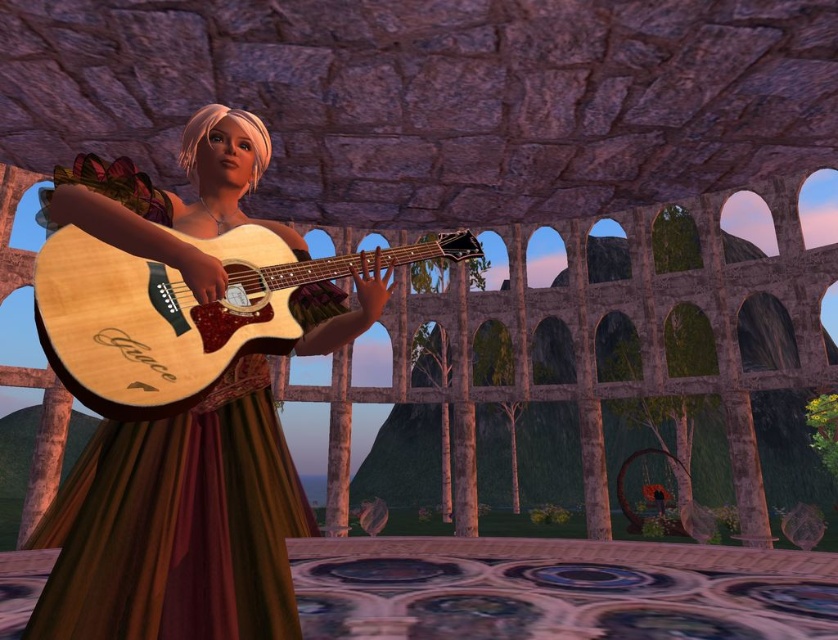
Question: Which of the following is the closest to the observer?

Choices:
 (A) (140, 186)
 (B) (96, 369)

Answer: (B)

Question: Can you confirm if wooden guitar at center is positioned above natural wood guitar at center?

Choices:
 (A) no
 (B) yes

Answer: (A)

Question: Can you confirm if wooden guitar at center is wider than natural wood guitar at center?

Choices:
 (A) yes
 (B) no

Answer: (B)

Question: Does wooden guitar at center come in front of natural wood guitar at center?

Choices:
 (A) no
 (B) yes

Answer: (A)

Question: Which object appears farthest from the camera in this image?

Choices:
 (A) natural wood guitar at center
 (B) wooden guitar at center

Answer: (B)

Question: Which of the following is the closest to the observer?

Choices:
 (A) natural wood guitar at center
 (B) wooden guitar at center

Answer: (A)